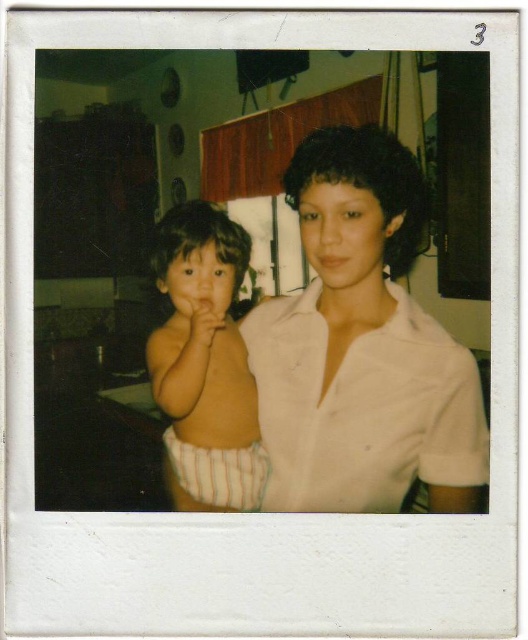
Question: Can you confirm if white smooth shirt at center is positioned below striped diaper at left?

Choices:
 (A) no
 (B) yes

Answer: (A)

Question: Is white smooth shirt at center to the right of striped diaper at left from the viewer's perspective?

Choices:
 (A) yes
 (B) no

Answer: (A)

Question: Does white smooth shirt at center have a larger size compared to striped diaper at left?

Choices:
 (A) yes
 (B) no

Answer: (A)

Question: Among these points, which one is nearest to the camera?

Choices:
 (A) (384, 157)
 (B) (232, 499)

Answer: (A)

Question: Which point is closer to the camera?

Choices:
 (A) (216, 339)
 (B) (357, 125)

Answer: (A)